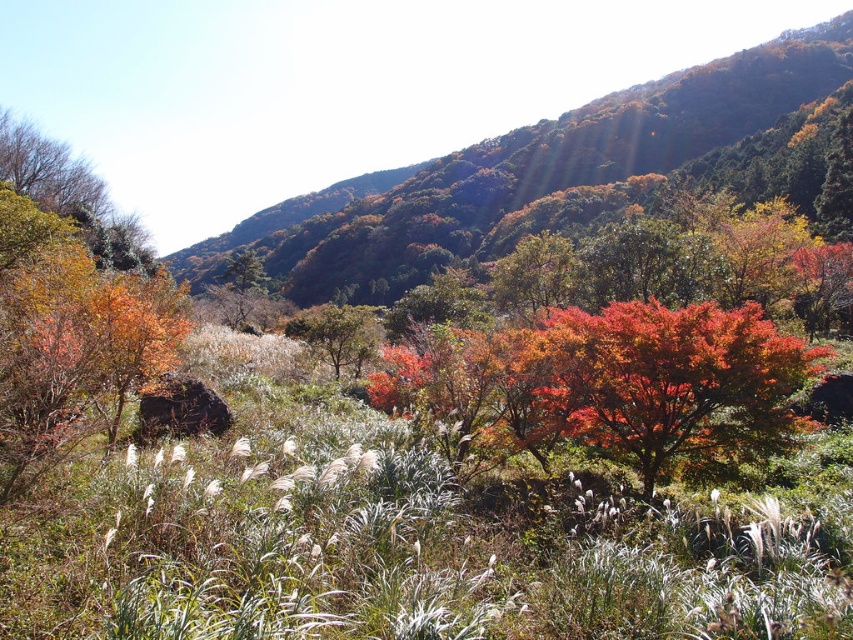
You are standing in the autumnal landscape and want to take a photo of both the autumn foliage at upper center and the vivid red leaves at center. Which object should you focus on first if you want to ensure both are in the frame?

Since the autumn foliage at upper center is much taller than the vivid red leaves at center, you should focus on the autumn foliage at upper center first to ensure both are in the frame.

You are a hiker standing in the field of tall grasses and looking towards the trees. Which object is higher in the scene, the autumn foliage at upper center or the green matte tree at center?

The autumn foliage at upper center is higher than the green matte tree at center because it is positioned above it in the scene.